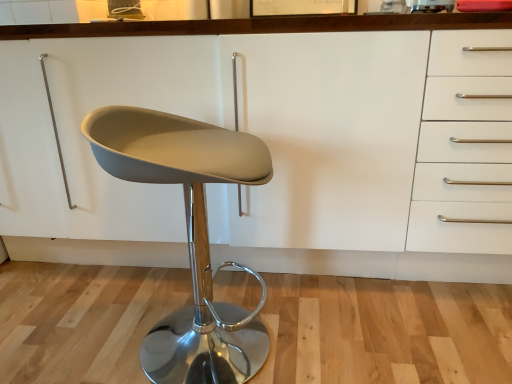
Question: Is matte gray seat at center positioned far away from white matte cabinet at center?

Choices:
 (A) yes
 (B) no

Answer: (B)

Question: Does matte gray seat at center have a larger size compared to white matte cabinet at center?

Choices:
 (A) no
 (B) yes

Answer: (A)

Question: From the image's perspective, does matte gray seat at center appear higher than white matte cabinet at center?

Choices:
 (A) no
 (B) yes

Answer: (A)

Question: Is matte gray seat at center positioned with its back to white matte cabinet at center?

Choices:
 (A) yes
 (B) no

Answer: (B)

Question: Considering the relative sizes of matte gray seat at center and white matte cabinet at center in the image provided, is matte gray seat at center taller than white matte cabinet at center?

Choices:
 (A) no
 (B) yes

Answer: (A)

Question: From a real-world perspective, is matte gray seat at center below white matte cabinet at center?

Choices:
 (A) no
 (B) yes

Answer: (B)

Question: Is white matte cabinet at center thinner than matte gray seat at center?

Choices:
 (A) yes
 (B) no

Answer: (B)

Question: Does white matte cabinet at center have a larger size compared to matte gray seat at center?

Choices:
 (A) yes
 (B) no

Answer: (A)

Question: Does white matte cabinet at center lie in front of matte gray seat at center?

Choices:
 (A) yes
 (B) no

Answer: (B)

Question: Considering the relative sizes of white matte cabinet at center and matte gray seat at center in the image provided, is white matte cabinet at center shorter than matte gray seat at center?

Choices:
 (A) no
 (B) yes

Answer: (A)

Question: Could you tell me if white matte cabinet at center is turned towards matte gray seat at center?

Choices:
 (A) no
 (B) yes

Answer: (B)

Question: Is white matte cabinet at center not close to matte gray seat at center?

Choices:
 (A) no
 (B) yes

Answer: (A)

Question: Considering the positions of matte gray seat at center and white matte cabinet at center in the image, is matte gray seat at center taller or shorter than white matte cabinet at center?

Choices:
 (A) short
 (B) tall

Answer: (A)